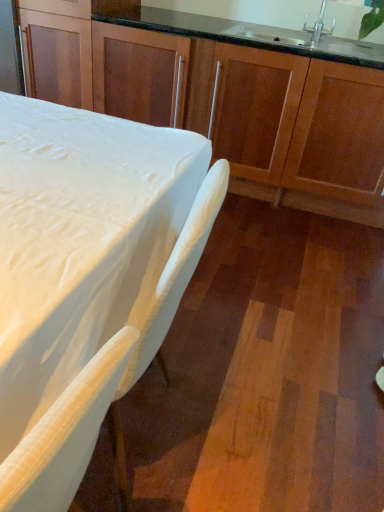
Question: Does white matte table at lower left have a larger size compared to silver metallic faucet at upper right?

Choices:
 (A) no
 (B) yes

Answer: (B)

Question: Considering the relative sizes of white matte table at lower left and silver metallic faucet at upper right in the image provided, is white matte table at lower left shorter than silver metallic faucet at upper right?

Choices:
 (A) no
 (B) yes

Answer: (A)

Question: From a real-world perspective, is white matte table at lower left beneath silver metallic faucet at upper right?

Choices:
 (A) no
 (B) yes

Answer: (B)

Question: Is white matte table at lower left taller than silver metallic faucet at upper right?

Choices:
 (A) no
 (B) yes

Answer: (B)

Question: Considering the relative sizes of white matte table at lower left and silver metallic faucet at upper right in the image provided, is white matte table at lower left wider than silver metallic faucet at upper right?

Choices:
 (A) yes
 (B) no

Answer: (A)

Question: Is wooden cabinets at center taller or shorter than silver metallic faucet at upper right?

Choices:
 (A) tall
 (B) short

Answer: (A)

Question: Is point (99, 3) positioned closer to the camera than point (322, 31)?

Choices:
 (A) closer
 (B) farther

Answer: (A)

Question: From a real-world perspective, is wooden cabinets at center physically located above or below silver metallic faucet at upper right?

Choices:
 (A) below
 (B) above

Answer: (A)

Question: Is wooden cabinets at center bigger or smaller than silver metallic faucet at upper right?

Choices:
 (A) small
 (B) big

Answer: (B)

Question: From a real-world perspective, is silver metallic faucet at upper right above or below wooden cabinets at center?

Choices:
 (A) above
 (B) below

Answer: (A)

Question: Is silver metallic faucet at upper right spatially inside wooden cabinets at center, or outside of it?

Choices:
 (A) inside
 (B) outside

Answer: (A)

Question: Relative to wooden cabinets at center, is silver metallic faucet at upper right in front or behind?

Choices:
 (A) front
 (B) behind

Answer: (B)

Question: Looking at their shapes, would you say silver metallic faucet at upper right is wider or thinner than wooden cabinets at center?

Choices:
 (A) wide
 (B) thin

Answer: (B)

Question: From a real-world perspective, is white matte table at lower left above or below wooden cabinets at center?

Choices:
 (A) below
 (B) above

Answer: (A)

Question: Considering the positions of white matte table at lower left and wooden cabinets at center in the image, is white matte table at lower left taller or shorter than wooden cabinets at center?

Choices:
 (A) tall
 (B) short

Answer: (B)